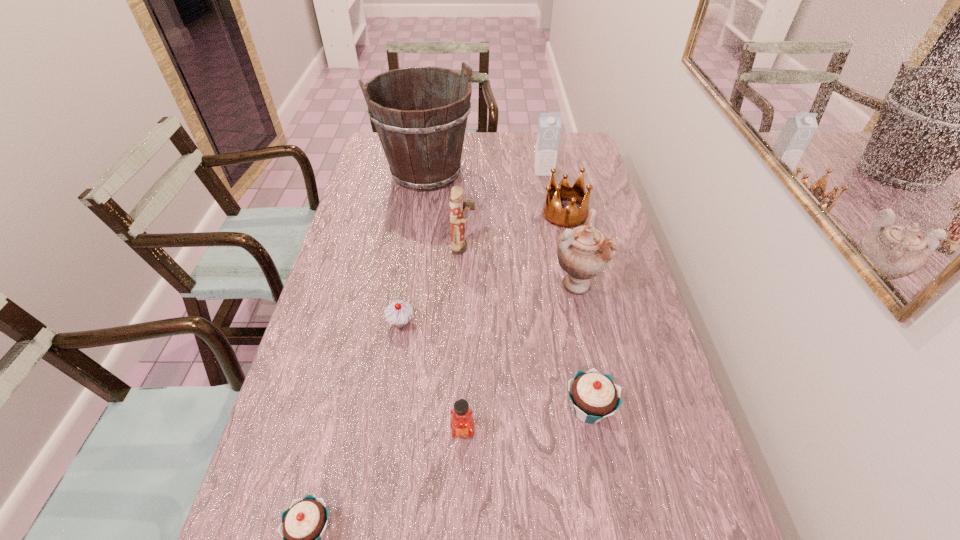
At what (x,y) coordinates should I click in order to perform the action: click on bucket. Please return your answer as a coordinate pair (x, y). This screenshot has width=960, height=540. Looking at the image, I should click on (422, 135).

At what (x,y) coordinates should I click in order to perform the action: click on carton. Please return your answer as a coordinate pair (x, y). Looking at the image, I should click on (549, 124).

Where is `urn`? urn is located at coordinates (583, 252).

Find the location of a particular element. the sixth nearest object is located at coordinates (457, 222).

The height and width of the screenshot is (540, 960). Find the location of `crown`. crown is located at coordinates (552, 211).

The image size is (960, 540). Identify the location of gray cupcake. (399, 313).

Where is `the sixth farthest object`? the sixth farthest object is located at coordinates (399, 313).

At what (x,y) coordinates should I click in order to perform the action: click on the rightmost cupcake. Please return your answer as a coordinate pair (x, y). Looking at the image, I should click on (594, 396).

Locate an element on the screen. Image resolution: width=960 pixels, height=540 pixels. the right teal cupcake is located at coordinates (594, 396).

The width and height of the screenshot is (960, 540). In order to click on honey in this screenshot , I will do `click(462, 424)`.